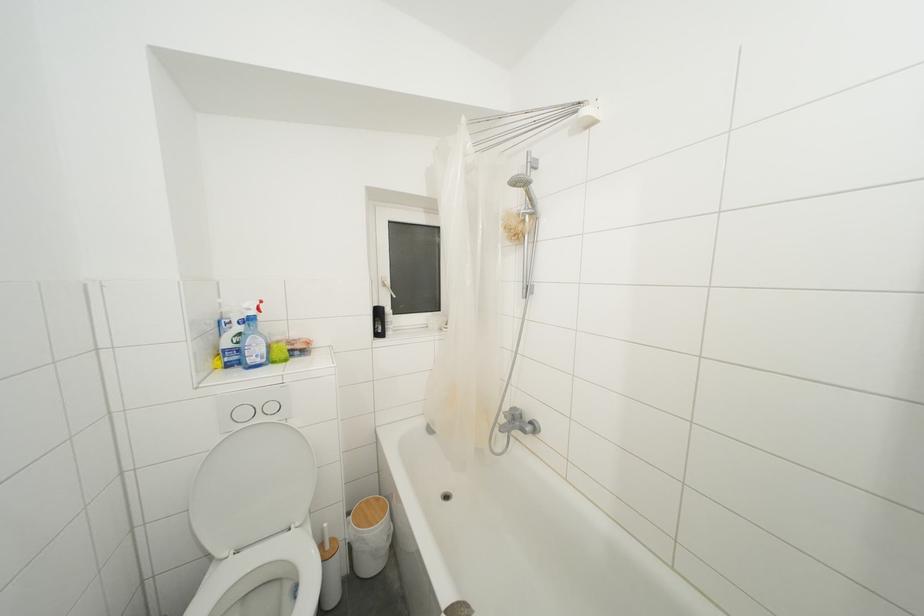
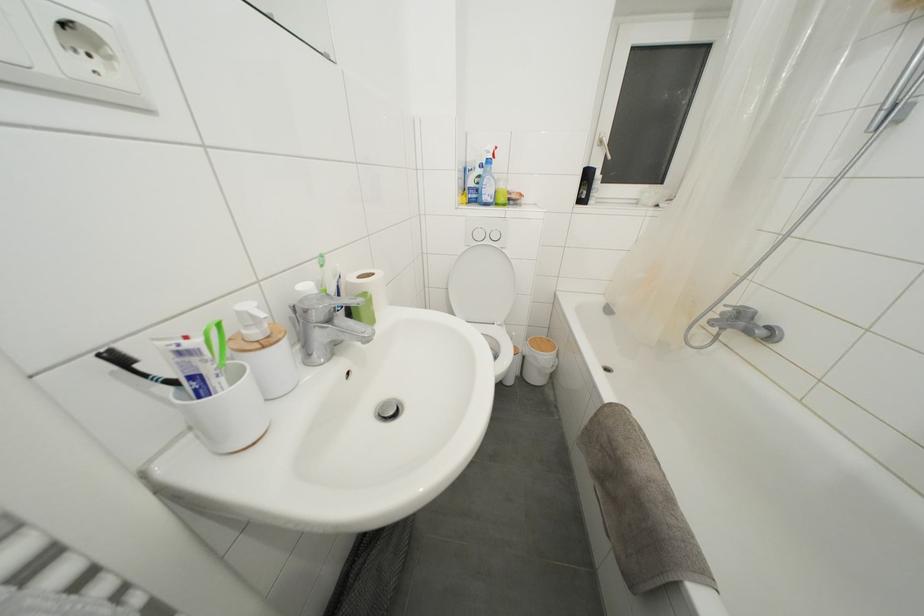
Find the pixel in the second image that matches [256,365] in the first image.

(490, 203)